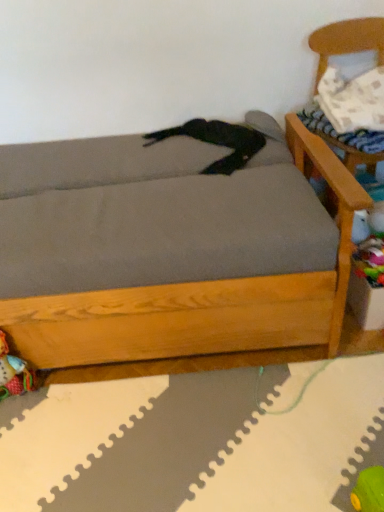
Locate an element on the screen. The image size is (384, 512). white textured pillow at upper right is located at coordinates (353, 100).

Measure the distance between point (372,234) and camera.

They are 4.16 feet apart.

Describe the element at coordinates (14, 372) in the screenshot. I see `multicolored fabric toy at lower left, the 1th toy in the bottom-to-top sequence` at that location.

Identify the location of wooden armchair at upper right. This screenshot has height=512, width=384. (347, 40).

Is multicolored plastic toy at lower right, which is the 1th toy in right-to-left order, bigger or smaller than multicolored fabric toy at lower left, the 1th toy in the bottom-to-top sequence?

Clearly, multicolored plastic toy at lower right, which is the 1th toy in right-to-left order, is smaller in size than multicolored fabric toy at lower left, the 1th toy in the bottom-to-top sequence.

Is multicolored plastic toy at lower right, which appears as the second toy when viewed from the left, not close to multicolored fabric toy at lower left, the 1th toy in the bottom-to-top sequence?

No, multicolored plastic toy at lower right, which appears as the second toy when viewed from the left, is not far from multicolored fabric toy at lower left, the 1th toy in the bottom-to-top sequence.

In the image, is multicolored plastic toy at lower right, which is the 1th toy in right-to-left order, on the left side or the right side of multicolored fabric toy at lower left, the 2th toy positioned from the right?

Based on their positions, multicolored plastic toy at lower right, which is the 1th toy in right-to-left order, is located to the right of multicolored fabric toy at lower left, the 2th toy positioned from the right.

Looking at this image, between multicolored plastic toy at lower right, the 2th toy positioned from the bottom, and multicolored fabric toy at lower left, the 2th toy positioned from the right, which one is positioned behind?

multicolored plastic toy at lower right, the 2th toy positioned from the bottom, is further from the camera.

Does gray fabric studio couch at center have a smaller size compared to wooden armchair at upper right?

No.

Between gray fabric studio couch at center and wooden armchair at upper right, which one has less height?

Standing shorter between the two is gray fabric studio couch at center.

How different are the orientations of gray fabric studio couch at center and wooden armchair at upper right in degrees?

They differ by 9.36 degrees in their facing directions.

Based on the photo, can wooden armchair at upper right be found inside gray fabric studio couch at center?

No, gray fabric studio couch at center does not contain wooden armchair at upper right.

From the picture: Considering the positions of objects wooden armchair at upper right and gray fabric studio couch at center in the image provided, who is in front, wooden armchair at upper right or gray fabric studio couch at center?

gray fabric studio couch at center is more forward.

Considering the sizes of objects wooden armchair at upper right and gray fabric studio couch at center in the image provided, who is wider, wooden armchair at upper right or gray fabric studio couch at center?

Wider between the two is gray fabric studio couch at center.

Could you tell me if wooden armchair at upper right is facing gray fabric studio couch at center?

No.

You are a GUI agent. You are given a task and a screenshot of the screen. Output one action in this format:
    pyautogui.click(x=<x>, y=<y>)
    Task: Click on the studio couch in front of the wooden armchair at upper right
    
    Given the screenshot: What is the action you would take?
    pyautogui.click(x=170, y=250)

Is multicolored fabric toy at lower left, the 2th toy positioned from the right, wider than gray fabric studio couch at center?

Incorrect, the width of multicolored fabric toy at lower left, the 2th toy positioned from the right, does not surpass that of gray fabric studio couch at center.

Who is bigger, multicolored fabric toy at lower left, the 1th toy positioned from the left, or gray fabric studio couch at center?

Bigger between the two is gray fabric studio couch at center.

Between multicolored fabric toy at lower left, marked as the 2th toy in a top-to-bottom arrangement, and gray fabric studio couch at center, which one appears on the left side from the viewer's perspective?

multicolored fabric toy at lower left, marked as the 2th toy in a top-to-bottom arrangement, is more to the left.

From a real-world perspective, is multicolored fabric toy at lower left, the 1th toy in the bottom-to-top sequence, above or below gray fabric studio couch at center?

multicolored fabric toy at lower left, the 1th toy in the bottom-to-top sequence, is below gray fabric studio couch at center.

Considering their positions, is wooden armchair at upper right located in front of or behind multicolored plastic toy at lower right, which is the 1th toy in right-to-left order?

Visually, wooden armchair at upper right is located in front of multicolored plastic toy at lower right, which is the 1th toy in right-to-left order.

Could you tell me if wooden armchair at upper right is facing multicolored plastic toy at lower right, which appears as the second toy when viewed from the left?

Yes, wooden armchair at upper right faces towards multicolored plastic toy at lower right, which appears as the second toy when viewed from the left.

From the image's perspective, relative to multicolored plastic toy at lower right, which appears as the 1th toy when viewed from the top, is wooden armchair at upper right above or below?

From the image's perspective, wooden armchair at upper right appears above multicolored plastic toy at lower right, which appears as the 1th toy when viewed from the top.

Is multicolored plastic toy at lower right, which is the 1th toy in right-to-left order, at the back of multicolored fabric toy at lower left, the 1th toy in the bottom-to-top sequence?

No, multicolored fabric toy at lower left, the 1th toy in the bottom-to-top sequence, is not facing the opposite direction of multicolored plastic toy at lower right, which is the 1th toy in right-to-left order.

Is multicolored fabric toy at lower left, the 1th toy in the bottom-to-top sequence, at the left side of multicolored plastic toy at lower right, which appears as the 1th toy when viewed from the top?

Yes, multicolored fabric toy at lower left, the 1th toy in the bottom-to-top sequence, is to the left of multicolored plastic toy at lower right, which appears as the 1th toy when viewed from the top.

Which of these two, multicolored fabric toy at lower left, the 2th toy positioned from the right, or multicolored plastic toy at lower right, which appears as the second toy when viewed from the left, stands shorter?

multicolored plastic toy at lower right, which appears as the second toy when viewed from the left, is shorter.

Can we say white textured pillow at upper right lies outside multicolored fabric toy at lower left, the 2th toy positioned from the right?

Yes, white textured pillow at upper right is not within multicolored fabric toy at lower left, the 2th toy positioned from the right.

Is white textured pillow at upper right beside multicolored fabric toy at lower left, the 2th toy positioned from the right?

white textured pillow at upper right is not next to multicolored fabric toy at lower left, the 2th toy positioned from the right, and they're not touching.

From the image's perspective, is white textured pillow at upper right over multicolored fabric toy at lower left, the 1th toy in the bottom-to-top sequence?

Correct, white textured pillow at upper right appears higher than multicolored fabric toy at lower left, the 1th toy in the bottom-to-top sequence, in the image.

In the image, is white textured pillow at upper right positioned in front of or behind multicolored fabric toy at lower left, the 1th toy positioned from the left?

Clearly, white textured pillow at upper right is behind multicolored fabric toy at lower left, the 1th toy positioned from the left.

The width and height of the screenshot is (384, 512). I want to click on toy in front of the multicolored plastic toy at lower right, the 2th toy positioned from the bottom, so click(x=14, y=372).

The height and width of the screenshot is (512, 384). Find the location of `studio couch lying on the left of wooden armchair at upper right`. studio couch lying on the left of wooden armchair at upper right is located at coordinates (170, 250).

Based on their spatial positions, is white textured pillow at upper right or gray fabric studio couch at center further from multicolored fabric toy at lower left, the 1th toy in the bottom-to-top sequence?

white textured pillow at upper right is positioned further to the anchor multicolored fabric toy at lower left, the 1th toy in the bottom-to-top sequence.

From the image, which object appears to be nearer to white textured pillow at upper right, multicolored plastic toy at lower right, which is the 1th toy in right-to-left order, or multicolored fabric toy at lower left, the 2th toy positioned from the right?

multicolored plastic toy at lower right, which is the 1th toy in right-to-left order, is positioned closer to the anchor white textured pillow at upper right.

Estimate the real-world distances between objects in this image. Which object is further from gray fabric studio couch at center, white textured pillow at upper right or multicolored plastic toy at lower right, which is the 1th toy in right-to-left order?

white textured pillow at upper right is positioned further to the anchor gray fabric studio couch at center.

Looking at the image, which one is located further to multicolored fabric toy at lower left, the 1th toy positioned from the left, wooden armchair at upper right or gray fabric studio couch at center?

wooden armchair at upper right.

From the image, which object appears to be nearer to gray fabric studio couch at center, multicolored plastic toy at lower right, the 2th toy positioned from the bottom, or multicolored fabric toy at lower left, the 2th toy positioned from the right?

multicolored fabric toy at lower left, the 2th toy positioned from the right, lies closer to gray fabric studio couch at center than the other object.

Based on their spatial positions, is wooden armchair at upper right or multicolored plastic toy at lower right, which appears as the 1th toy when viewed from the top, closer to gray fabric studio couch at center?

multicolored plastic toy at lower right, which appears as the 1th toy when viewed from the top, lies closer to gray fabric studio couch at center than the other object.

Estimate the real-world distances between objects in this image. Which object is further from white textured pillow at upper right, gray fabric studio couch at center or wooden armchair at upper right?

gray fabric studio couch at center is further to white textured pillow at upper right.

Estimate the real-world distances between objects in this image. Which object is further from multicolored plastic toy at lower right, which appears as the second toy when viewed from the left, multicolored fabric toy at lower left, the 2th toy positioned from the right, or white textured pillow at upper right?

Based on the image, multicolored fabric toy at lower left, the 2th toy positioned from the right, appears to be further to multicolored plastic toy at lower right, which appears as the second toy when viewed from the left.

This screenshot has height=512, width=384. I want to click on studio couch between multicolored fabric toy at lower left, marked as the 2th toy in a top-to-bottom arrangement, and white textured pillow at upper right, so click(x=170, y=250).

In order to click on pillow between gray fabric studio couch at center and wooden armchair at upper right in this screenshot , I will do `click(353, 100)`.

I want to click on toy between multicolored fabric toy at lower left, marked as the 2th toy in a top-to-bottom arrangement, and white textured pillow at upper right, so click(370, 260).

In order to click on pillow located between multicolored fabric toy at lower left, the 1th toy positioned from the left, and wooden armchair at upper right in the left-right direction in this screenshot , I will do `click(353, 100)`.